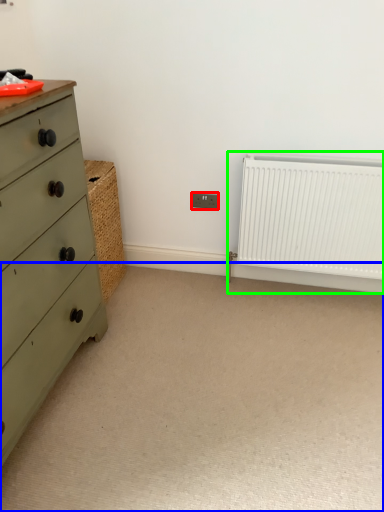
Question: Estimate the real-world distances between objects in this image. Which object is farther from electric outlet (highlighted by a red box), plain (highlighted by a blue box) or radiator (highlighted by a green box)?

Choices:
 (A) plain
 (B) radiator

Answer: (A)